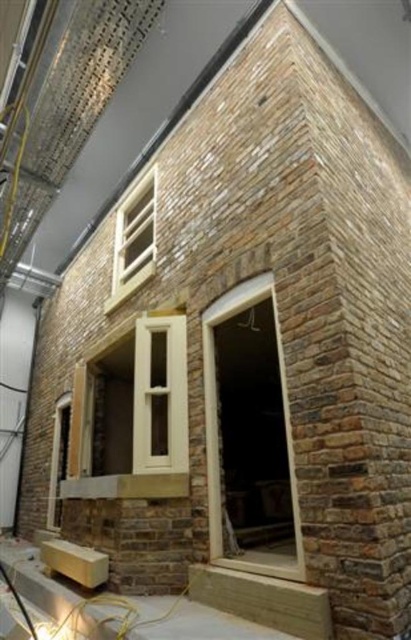
Measure the distance from smooth cream window at center to white wood window at upper center.

smooth cream window at center is 2.25 meters from white wood window at upper center.

Looking at this image, which is more to the left, smooth cream window at center or white wood window at upper center?

white wood window at upper center is more to the left.

Where is `smooth cream window at center`? The image size is (411, 640). smooth cream window at center is located at coordinates (217, 422).

Which is behind, point (173, 326) or point (138, 266)?

The point (138, 266) is more distant.

Who is more forward, (179,442) or (117,291)?

Positioned in front is point (179,442).

This screenshot has height=640, width=411. I want to click on white plastic window at center, so click(x=150, y=419).

Based on the photo, between white plastic window at center and smooth cream window at center, which one has more height?

smooth cream window at center

Who is more distant from viewer, (134,460) or (288,435)?

The point (134,460) is more distant.

Where is `white plastic window at center`? This screenshot has width=411, height=640. white plastic window at center is located at coordinates point(150,419).